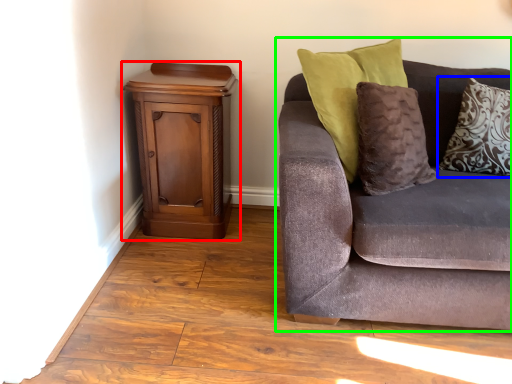
Question: Which object is positioned closest to nightstand (highlighted by a red box)? Select from pillow (highlighted by a blue box) and studio couch (highlighted by a green box).

Choices:
 (A) pillow
 (B) studio couch

Answer: (B)